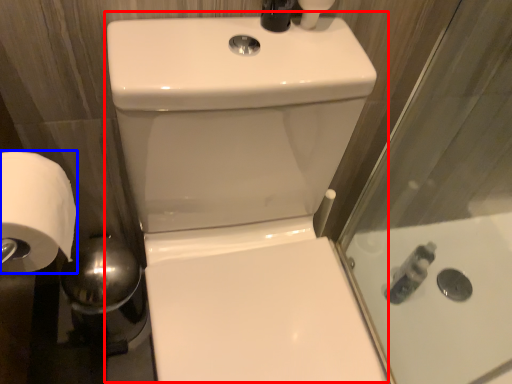
Question: Which object is further to the camera taking this photo, sink (highlighted by a red box) or toilet paper (highlighted by a blue box)?

Choices:
 (A) sink
 (B) toilet paper

Answer: (B)